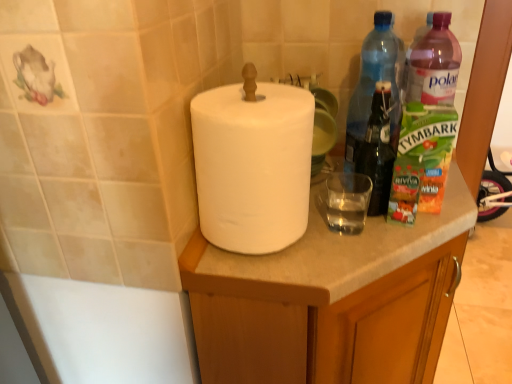
Identify the location of free space to the left of transparent glass at center. (285, 249).